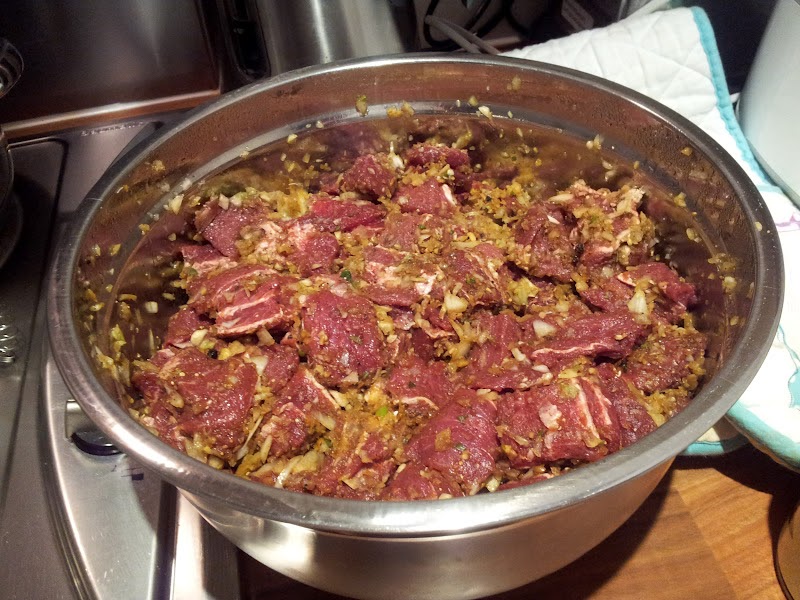
Find the location of a particular element. inside of bowl is located at coordinates (252, 120).